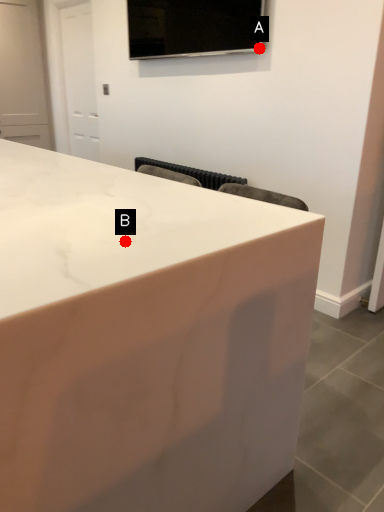
Question: Two points are circled on the image, labeled by A and B beside each circle. Which point appears farthest from the camera in this image?

Choices:
 (A) A is further
 (B) B is further

Answer: (A)